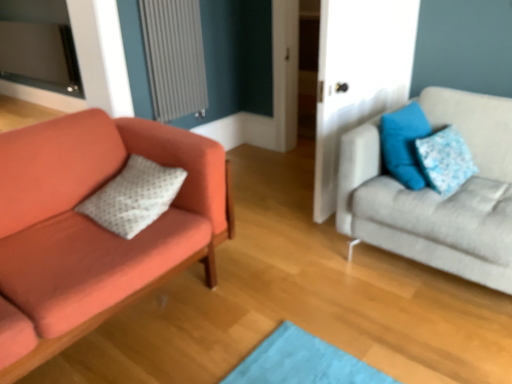
Question: Does blue fabric pillow at upper right, placed as the 2th pillow when sorted from right to left, have a lesser height compared to gray textured radiator at upper left?

Choices:
 (A) no
 (B) yes

Answer: (B)

Question: From the image's perspective, is blue fabric pillow at upper right, placed as the 2th pillow when sorted from left to right, over gray textured radiator at upper left?

Choices:
 (A) yes
 (B) no

Answer: (B)

Question: Considering the relative positions of blue fabric pillow at upper right, placed as the 2th pillow when sorted from right to left, and gray textured radiator at upper left in the image provided, is blue fabric pillow at upper right, placed as the 2th pillow when sorted from right to left, behind gray textured radiator at upper left?

Choices:
 (A) yes
 (B) no

Answer: (B)

Question: Does blue fabric pillow at upper right, placed as the 2th pillow when sorted from left to right, have a larger size compared to gray textured radiator at upper left?

Choices:
 (A) yes
 (B) no

Answer: (A)

Question: Is blue fabric pillow at upper right, placed as the 2th pillow when sorted from left to right, to the left of gray textured radiator at upper left from the viewer's perspective?

Choices:
 (A) yes
 (B) no

Answer: (B)

Question: Is blue fabric pillow at upper right, placed as the 2th pillow when sorted from left to right, bigger or smaller than light gray fabric couch at right, which is counted as the second studio couch, starting from the left?

Choices:
 (A) big
 (B) small

Answer: (B)

Question: Based on their positions, is blue fabric pillow at upper right, placed as the 2th pillow when sorted from right to left, located to the left or right of light gray fabric couch at right, which ranks as the 1th studio couch in right-to-left order?

Choices:
 (A) left
 (B) right

Answer: (A)

Question: Considering the positions of blue fabric pillow at upper right, placed as the 2th pillow when sorted from right to left, and light gray fabric couch at right, which ranks as the 1th studio couch in right-to-left order, in the image, is blue fabric pillow at upper right, placed as the 2th pillow when sorted from right to left, taller or shorter than light gray fabric couch at right, which ranks as the 1th studio couch in right-to-left order,?

Choices:
 (A) tall
 (B) short

Answer: (B)

Question: Is blue fabric pillow at upper right, placed as the 2th pillow when sorted from right to left, inside the boundaries of light gray fabric couch at right, which ranks as the 1th studio couch in right-to-left order, or outside?

Choices:
 (A) outside
 (B) inside

Answer: (B)

Question: Is blue fabric pillow at upper right, which ranks as the third pillow in left-to-right order, bigger or smaller than white dotted pillow at left, which appears as the third pillow when viewed from the right?

Choices:
 (A) big
 (B) small

Answer: (B)

Question: Relative to white dotted pillow at left, which appears as the third pillow when viewed from the right, is blue fabric pillow at upper right, which ranks as the third pillow in left-to-right order, in front or behind?

Choices:
 (A) behind
 (B) front

Answer: (A)

Question: From the image's perspective, is blue fabric pillow at upper right, which ranks as the third pillow in left-to-right order, positioned above or below white dotted pillow at left, which appears as the third pillow when viewed from the right?

Choices:
 (A) below
 (B) above

Answer: (B)

Question: From a real-world perspective, is blue fabric pillow at upper right, positioned as the first pillow in right-to-left order, physically located above or below white dotted pillow at left, which appears as the third pillow when viewed from the right?

Choices:
 (A) below
 (B) above

Answer: (B)

Question: In terms of size, does blue fabric pillow at upper right, positioned as the first pillow in right-to-left order, appear bigger or smaller than matte orange couch at left, which is the first studio couch in left-to-right order?

Choices:
 (A) big
 (B) small

Answer: (B)

Question: Would you say blue fabric pillow at upper right, positioned as the first pillow in right-to-left order, is to the left or to the right of matte orange couch at left, the second studio couch from the right, in the picture?

Choices:
 (A) right
 (B) left

Answer: (A)